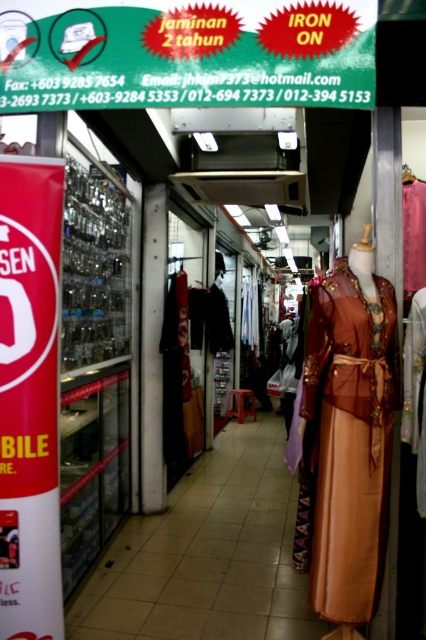
Question: Can you confirm if red glossy iron at upper center is thinner than matte brown dress at right?

Choices:
 (A) yes
 (B) no

Answer: (B)

Question: Which point is closer to the camera taking this photo?

Choices:
 (A) (46, 100)
 (B) (348, 420)

Answer: (A)

Question: Does red glossy iron at upper center have a smaller size compared to matte brown dress at right?

Choices:
 (A) yes
 (B) no

Answer: (A)

Question: Is red glossy iron at upper center smaller than matte brown dress at right?

Choices:
 (A) yes
 (B) no

Answer: (A)